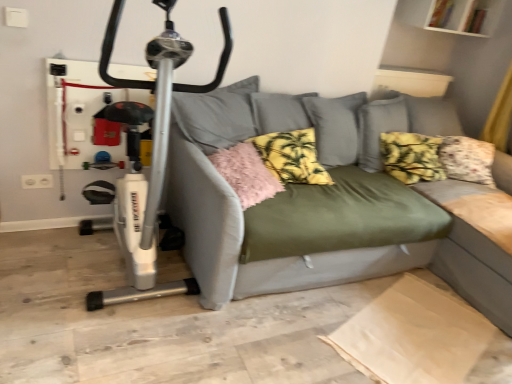
You are a GUI agent. You are given a task and a screenshot of the screen. Output one action in this format:
    pyautogui.click(x=<x>, y=<y>)
    Task: Click on the vacant space in white plastic exercise bike at left (from a real-world perspective)
    
    Given the screenshot: What is the action you would take?
    pyautogui.click(x=116, y=270)